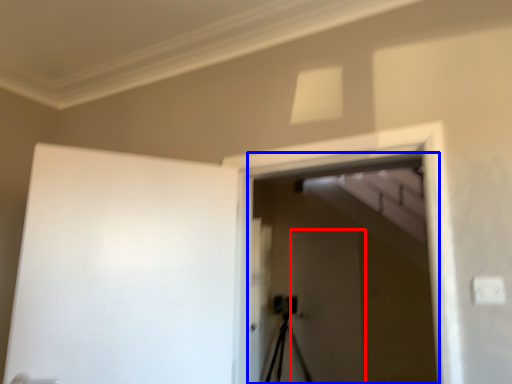
Question: Which object is further to the camera taking this photo, screen door (highlighted by a red box) or screen door (highlighted by a blue box)?

Choices:
 (A) screen door
 (B) screen door

Answer: (A)